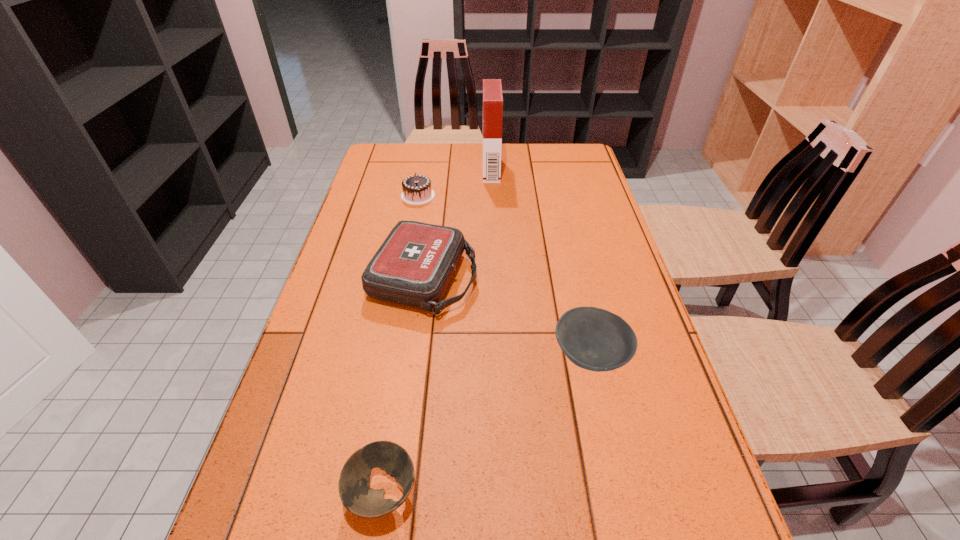
Where is `free space at the right edge of the desktop`? The height and width of the screenshot is (540, 960). free space at the right edge of the desktop is located at coordinates (562, 179).

In the image, there is a desktop. Where is `free space at the far left corner`? The width and height of the screenshot is (960, 540). free space at the far left corner is located at coordinates (371, 161).

The image size is (960, 540). Identify the location of blank space at the far right corner of the desktop. (562, 156).

In order to click on vacant space that's between the first-aid kit and the shortest object in this screenshot , I will do `click(403, 385)`.

Where is `vacant area that lies between the rightmost object and the second object from right to left`? vacant area that lies between the rightmost object and the second object from right to left is located at coordinates (540, 262).

The height and width of the screenshot is (540, 960). Find the location of `free space between the second object from right to left and the chocolate cake`. free space between the second object from right to left and the chocolate cake is located at coordinates (454, 183).

Locate an element on the screen. free space between the third nearest object and the rightmost object is located at coordinates (507, 317).

Find the location of a particular element. Image resolution: width=960 pixels, height=540 pixels. vacant area between the first-aid kit and the left bowl is located at coordinates (403, 385).

I want to click on free space between the farther bowl and the farthest object, so click(540, 262).

Where is `free spot between the shorter bowl and the fourth object from left to right`? free spot between the shorter bowl and the fourth object from left to right is located at coordinates (437, 331).